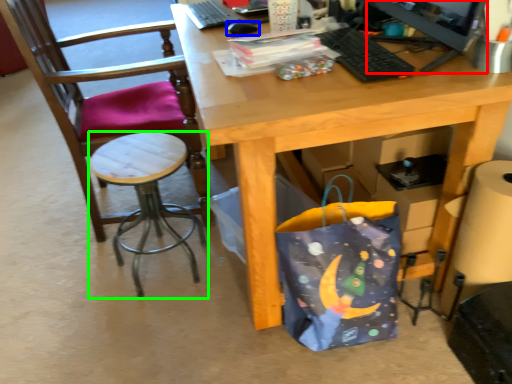
Question: Considering the real-world distances, which object is farthest from computer monitor (highlighted by a red box)? mouse (highlighted by a blue box) or stool (highlighted by a green box)?

Choices:
 (A) mouse
 (B) stool

Answer: (B)